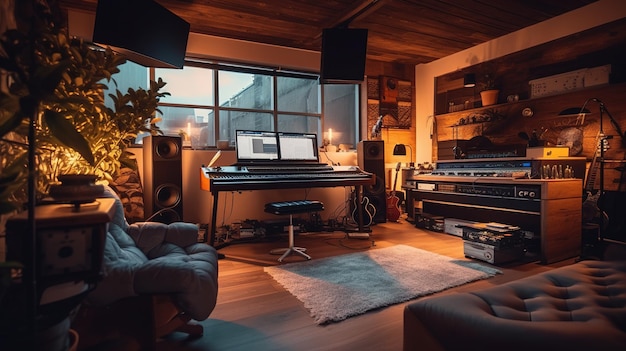
Image resolution: width=626 pixels, height=351 pixels. What are the coordinates of `futon` in the screenshot? It's located at (568, 315).